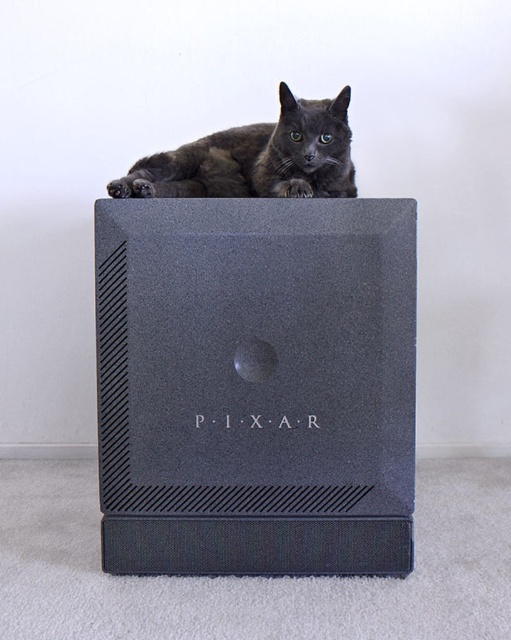
You are setting up a home theater system and need to place a new speaker. You have a matte black speaker at center and a shiny black cat at upper center in the scene. Which object is located to the right of the other?

The matte black speaker at center is positioned on the right side of shiny black cat at upper center, so the speaker is to the right of the cat.

You are setting up a home theater system and need to place a matte black speaker at center and a shiny black cat at upper center. Given their sizes, which object would require more vertical space in your setup?

The matte black speaker at center requires more vertical space because it is much taller than the shiny black cat at upper center.

You are a photographer setting up a shot of the matte black speaker at center and the shiny black cat at upper center. To ensure both are in focus, you need to know their relative distances from the camera. Which object is closer to the camera?

The matte black speaker at center is closer to the viewer than the shiny black cat at upper center, so the speaker is closer to the camera.